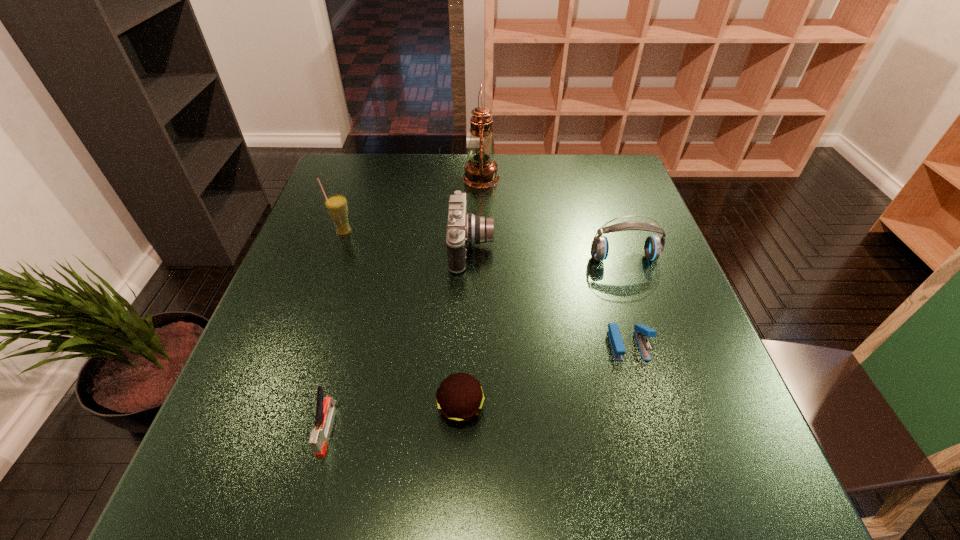
Where is `the right stapler`? The height and width of the screenshot is (540, 960). the right stapler is located at coordinates (640, 330).

Identify the location of vacant region located on the front of the tallest object. (482, 263).

The image size is (960, 540). Find the location of `free location located 0.060m on the right of the leftmost object`. free location located 0.060m on the right of the leftmost object is located at coordinates (377, 232).

Find the location of a particular element. Image resolution: width=960 pixels, height=540 pixels. vacant area located 0.050m on the front-facing side of the camera is located at coordinates (513, 247).

Where is `free space located 0.060m on the ear cups of the headset`? The width and height of the screenshot is (960, 540). free space located 0.060m on the ear cups of the headset is located at coordinates (633, 284).

Image resolution: width=960 pixels, height=540 pixels. Find the location of `blank space located 0.220m on the left of the patty`. blank space located 0.220m on the left of the patty is located at coordinates (315, 408).

You are a GUI agent. You are given a task and a screenshot of the screen. Output one action in this format:
    pyautogui.click(x=<x>, y=<y>)
    Task: Click on the free space located 0.100m on the left of the farther stapler
    This screenshot has width=960, height=540.
    Given the screenshot: What is the action you would take?
    pyautogui.click(x=561, y=345)

At what (x,y) coordinates should I click in order to perform the action: click on object positioned at the far edge. Please return your answer as a coordinate pair (x, y). This screenshot has height=540, width=960. Looking at the image, I should click on (481, 171).

Locate an element on the screen. object located at the left edge is located at coordinates (336, 205).

Image resolution: width=960 pixels, height=540 pixels. I want to click on headset that is positioned at the right edge, so click(653, 248).